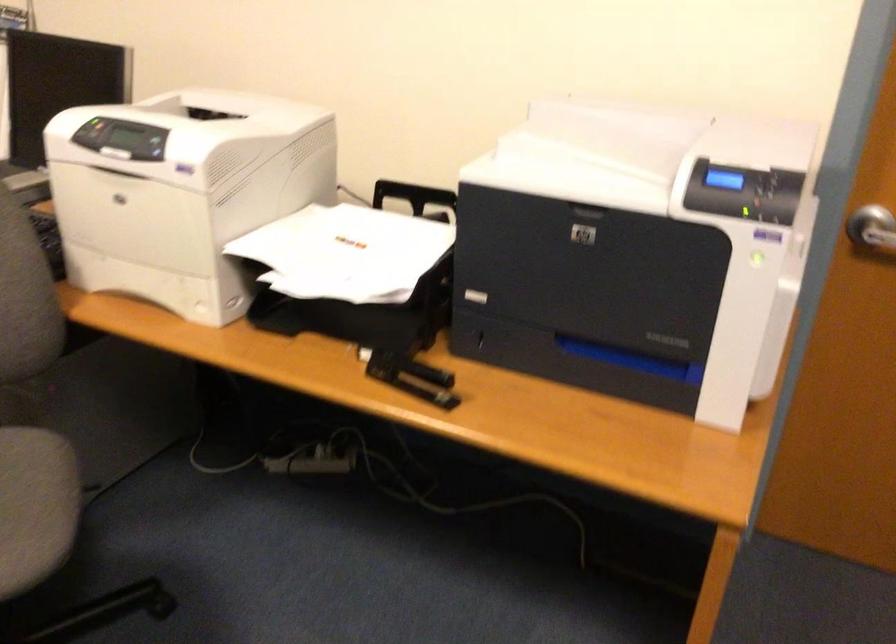
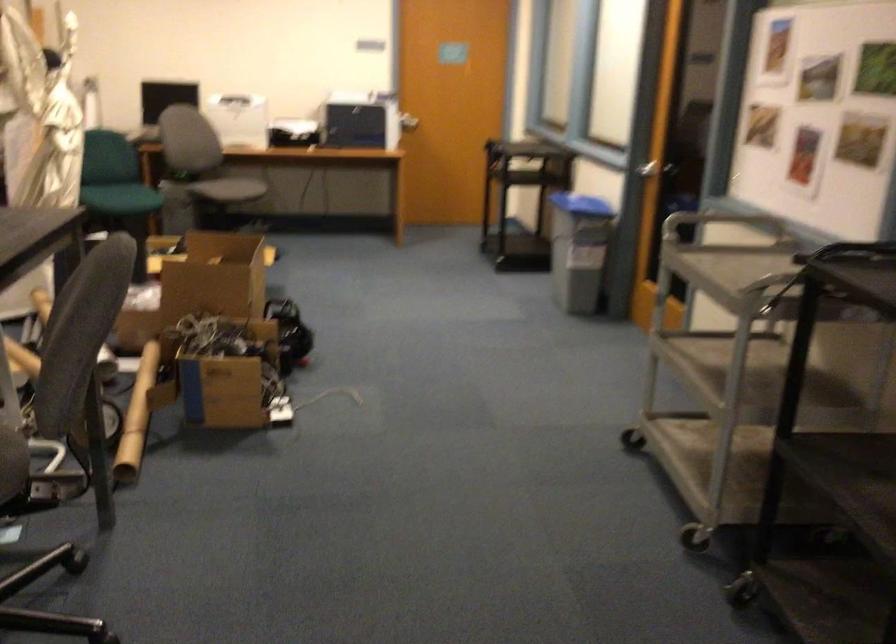
Find the pixel in the second image that matches [823,279] in the first image.

(409, 122)